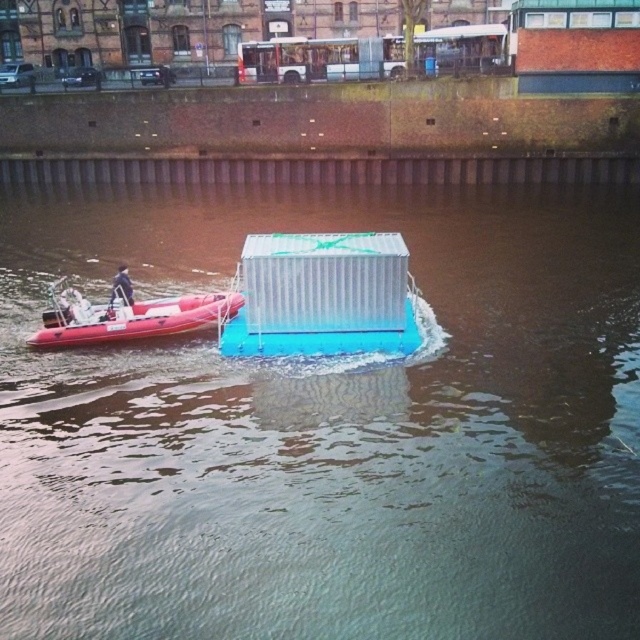
What do you see at coordinates (328, 428) in the screenshot? I see `metallic blue container at center` at bounding box center [328, 428].

Who is positioned more to the right, metallic blue container at center or rubber boat at left?

Positioned to the right is metallic blue container at center.

At what (x,y) coordinates should I click in order to perform the action: click on metallic blue container at center. Please return your answer as a coordinate pair (x, y). Looking at the image, I should click on (328, 428).